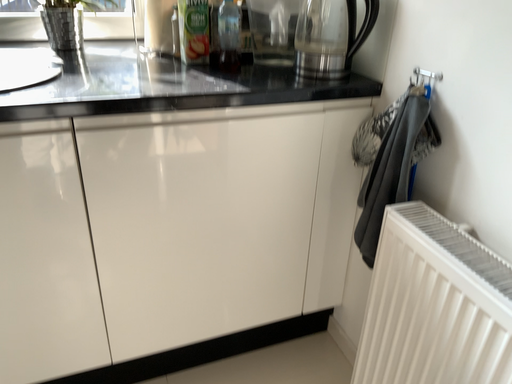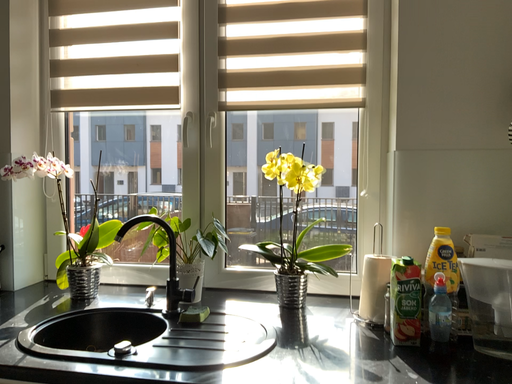
Question: Which way did the camera rotate in the video?

Choices:
 (A) rotated upward
 (B) rotated downward

Answer: (A)